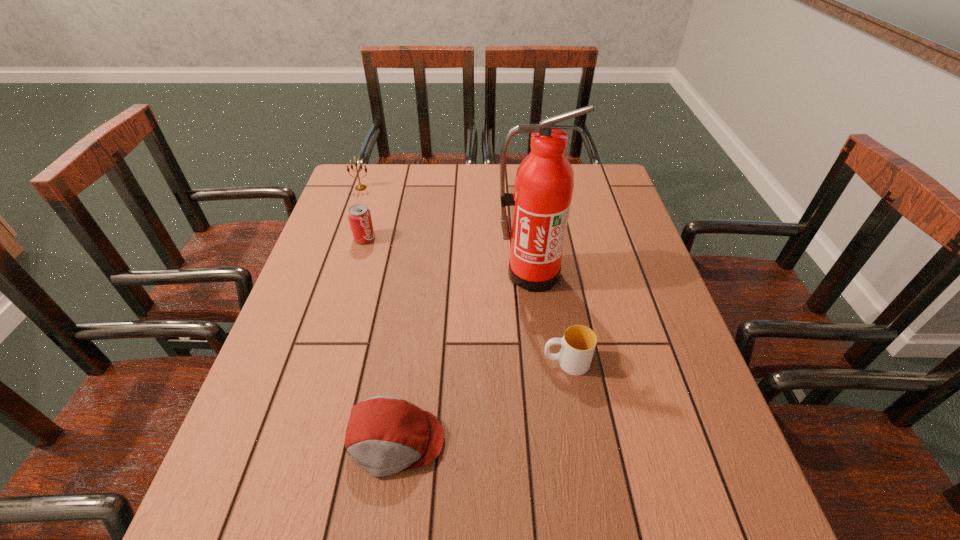
You are a GUI agent. You are given a task and a screenshot of the screen. Output one action in this format:
    pyautogui.click(x=<x>, y=<y>)
    Task: Click on the free point between the third nearest object and the candelabrum
    
    Given the screenshot: What is the action you would take?
    click(445, 231)

You are a GUI agent. You are given a task and a screenshot of the screen. Output one action in this format:
    pyautogui.click(x=<x>, y=<y>)
    Task: Click on the free point between the third object from right to left and the tallest object
    
    Given the screenshot: What is the action you would take?
    pyautogui.click(x=463, y=357)

At what (x,y) coordinates should I click in order to perform the action: click on free space between the candelabrum and the nearest object. Please return your answer as a coordinate pair (x, y). The width and height of the screenshot is (960, 540). Looking at the image, I should click on (378, 314).

Where is `the second closest object to the third farthest object`? the second closest object to the third farthest object is located at coordinates pos(385,435).

Find the location of a particular element. object that is the second closest one to the fourth farthest object is located at coordinates (385, 435).

This screenshot has width=960, height=540. In order to click on free space that satisfies the following two spatial constraints: 1. with the handle on the side of the second nearest object; 2. on the front side of the farthest object in this screenshot , I will do `click(537, 188)`.

Identify the location of free space in the image that satisfies the following two spatial constraints: 1. with the handle on the side of the second nearest object; 2. on the label side of the tallest object. (551, 274).

Identify the location of free space that satisfies the following two spatial constraints: 1. on the label side of the tallest object; 2. with the handle on the side of the second nearest object. The image size is (960, 540). pyautogui.click(x=541, y=362).

Locate an element on the screen. free point that satisfies the following two spatial constraints: 1. on the label side of the fire extinguisher; 2. with the handle on the side of the fourth farthest object is located at coordinates (541, 362).